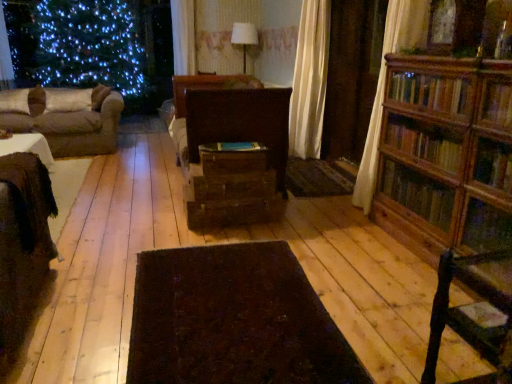
Question: Is brown wood drawer at center, positioned as the 2th drawer in top-to-bottom order, at the right side of white fabric lampshade at upper center?

Choices:
 (A) yes
 (B) no

Answer: (B)

Question: Is the surface of brown wood drawer at center, marked as the first drawer in a bottom-to-top arrangement, in direct contact with white fabric lampshade at upper center?

Choices:
 (A) no
 (B) yes

Answer: (A)

Question: Is white fabric lampshade at upper center completely or partially inside brown wood drawer at center, marked as the first drawer in a bottom-to-top arrangement?

Choices:
 (A) yes
 (B) no

Answer: (B)

Question: Is brown wood drawer at center, positioned as the 2th drawer in top-to-bottom order, oriented away from white fabric lampshade at upper center?

Choices:
 (A) no
 (B) yes

Answer: (A)

Question: From a real-world perspective, is brown wood drawer at center, marked as the first drawer in a bottom-to-top arrangement, under white fabric lampshade at upper center?

Choices:
 (A) no
 (B) yes

Answer: (B)

Question: From a real-world perspective, is brown wood drawer at center, positioned as the 2th drawer in top-to-bottom order, physically above white fabric lampshade at upper center?

Choices:
 (A) yes
 (B) no

Answer: (B)

Question: Does dark brown wooden chair at lower right have a lesser height compared to wooden drawer at center, which appears as the 1th drawer when viewed from the top?

Choices:
 (A) no
 (B) yes

Answer: (A)

Question: From the image's perspective, is dark brown wooden chair at lower right located above wooden drawer at center, which is the second drawer in bottom-to-top order?

Choices:
 (A) yes
 (B) no

Answer: (B)

Question: Is dark brown wooden chair at lower right taller than wooden drawer at center, which is the second drawer in bottom-to-top order?

Choices:
 (A) no
 (B) yes

Answer: (B)

Question: Is dark brown wooden chair at lower right thinner than wooden drawer at center, which is the second drawer in bottom-to-top order?

Choices:
 (A) no
 (B) yes

Answer: (B)

Question: Considering the relative sizes of dark brown wooden chair at lower right and wooden drawer at center, which appears as the 1th drawer when viewed from the top, in the image provided, is dark brown wooden chair at lower right smaller than wooden drawer at center, which appears as the 1th drawer when viewed from the top,?

Choices:
 (A) yes
 (B) no

Answer: (B)

Question: Does dark brown wooden chair at lower right turn towards wooden drawer at center, which appears as the 1th drawer when viewed from the top?

Choices:
 (A) no
 (B) yes

Answer: (B)

Question: Is green fabric curtain at upper left positioned beyond the bounds of brown fabric couch at left?

Choices:
 (A) no
 (B) yes

Answer: (B)